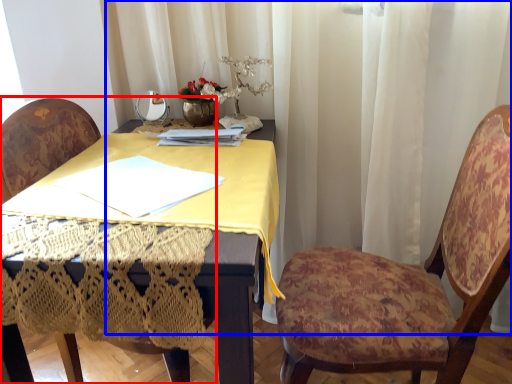
Question: Which object appears farthest to the camera in this image, chair (highlighted by a red box) or curtain (highlighted by a blue box)?

Choices:
 (A) chair
 (B) curtain

Answer: (B)